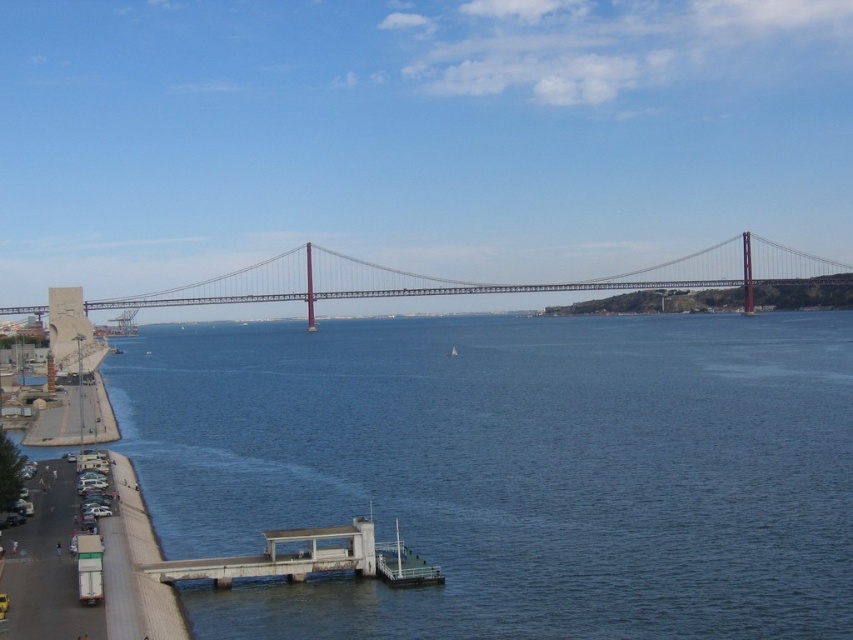
Question: Does blue water at center have a larger size compared to metallic gray suspension bridge at center?

Choices:
 (A) yes
 (B) no

Answer: (B)

Question: Can you confirm if blue water at center is smaller than metallic gray suspension bridge at center?

Choices:
 (A) no
 (B) yes

Answer: (B)

Question: Can you confirm if blue water at center is bigger than metallic gray suspension bridge at center?

Choices:
 (A) no
 (B) yes

Answer: (A)

Question: Which of the following is the closest to the observer?

Choices:
 (A) (595, 408)
 (B) (790, 250)

Answer: (A)

Question: Which object appears closest to the camera in this image?

Choices:
 (A) blue water at center
 (B) metallic gray suspension bridge at center

Answer: (A)

Question: Which of the following is the farthest from the observer?

Choices:
 (A) metallic gray suspension bridge at center
 (B) blue water at center

Answer: (A)